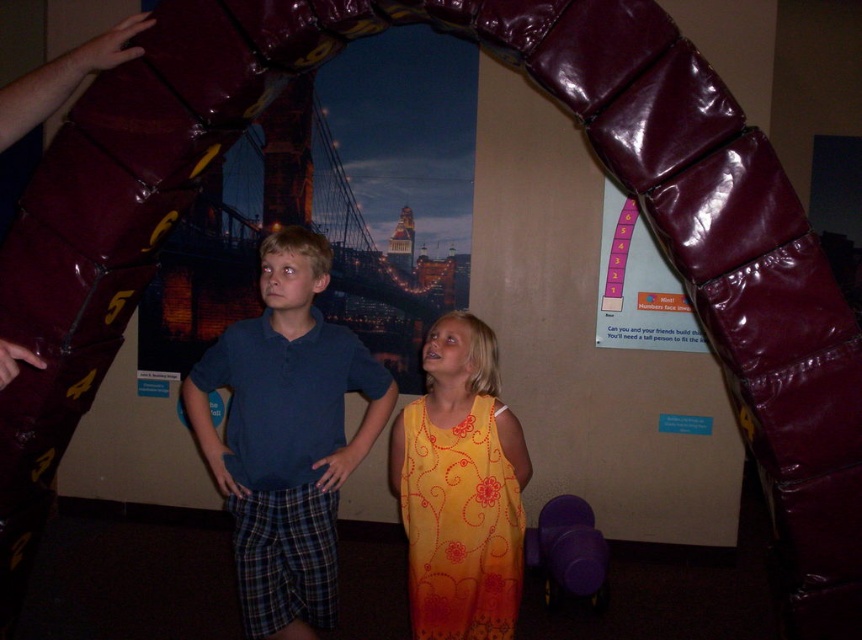
Who is positioned more to the right, blue cotton shirt at center or yellow floral dress at center?

yellow floral dress at center

Between blue cotton shirt at center and yellow floral dress at center, which one appears on the left side from the viewer's perspective?

blue cotton shirt at center is more to the left.

Which is behind, point (280, 352) or point (508, 632)?

The point (280, 352) is behind.

The width and height of the screenshot is (862, 640). I want to click on blue cotton shirt at center, so click(x=286, y=436).

This screenshot has height=640, width=862. What do you see at coordinates (286, 400) in the screenshot?
I see `matte blue polo shirt at center` at bounding box center [286, 400].

Who is positioned more to the right, matte blue polo shirt at center or maroon leather armrest at upper left?

Positioned to the right is matte blue polo shirt at center.

This screenshot has height=640, width=862. Describe the element at coordinates (286, 400) in the screenshot. I see `matte blue polo shirt at center` at that location.

Locate an element on the screen. The image size is (862, 640). matte blue polo shirt at center is located at coordinates (286, 400).

Between point (339, 480) and point (129, 48), which one is positioned behind?

The point (129, 48) is more distant.

The image size is (862, 640). Find the location of `blue cotton shirt at center`. blue cotton shirt at center is located at coordinates (286, 436).